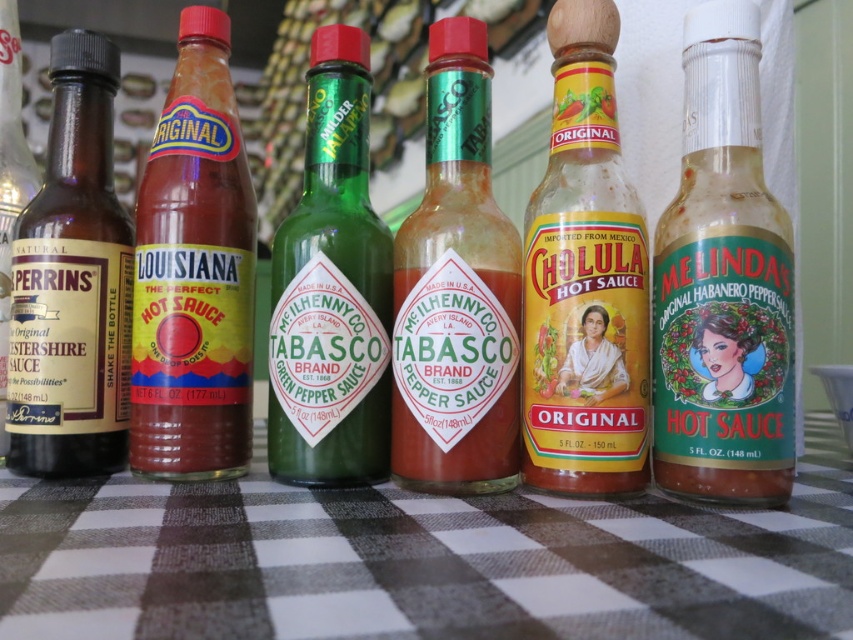
Question: Estimate the real-world distances between objects in this image. Which object is closer to the brown glass bottle at left?

Choices:
 (A) matte glass bottle at center
 (B) green glass tabasco bottle at center
 (C) black checkered tablecloth at center

Answer: (B)

Question: Which point appears farthest from the camera in this image?

Choices:
 (A) (247, 180)
 (B) (39, 504)
 (C) (96, 74)

Answer: (C)

Question: Which of the following is the farthest from the observer?

Choices:
 (A) (595, 525)
 (B) (490, 385)
 (C) (312, 260)
 (D) (212, 161)

Answer: (D)

Question: Does black checkered tablecloth at center come behind matte glass hot sauce at center?

Choices:
 (A) no
 (B) yes

Answer: (A)

Question: Is green glass tabasco bottle at center wider than brown glass bottle at left?

Choices:
 (A) yes
 (B) no

Answer: (A)

Question: Does matte glass bottle at center lie behind green glass tabasco bottle at center?

Choices:
 (A) no
 (B) yes

Answer: (A)